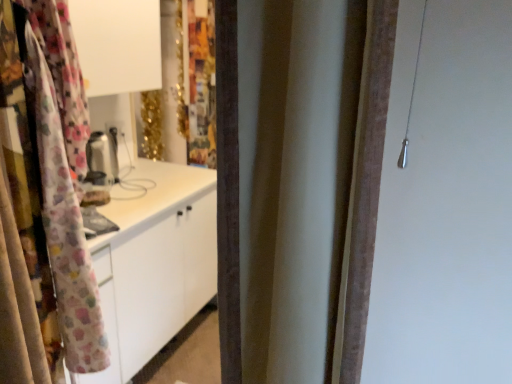
Describe the element at coordinates (44, 232) in the screenshot. I see `floral fabric curtain at left` at that location.

The width and height of the screenshot is (512, 384). In order to click on floral fabric curtain at left in this screenshot , I will do `click(44, 232)`.

Identify the location of floral fabric curtain at left. This screenshot has height=384, width=512. (44, 232).